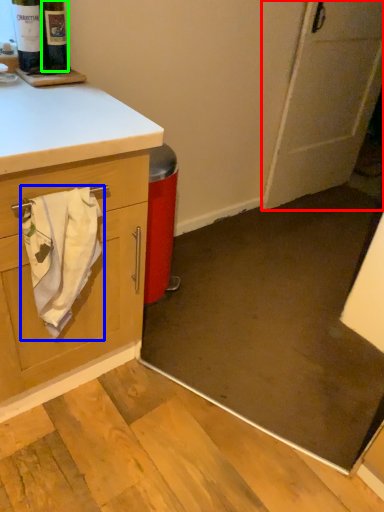
Question: Considering the real-world distances, which object is farthest from door (highlighted by a red box)? bath towel (highlighted by a blue box) or wine bottle (highlighted by a green box)?

Choices:
 (A) bath towel
 (B) wine bottle

Answer: (A)